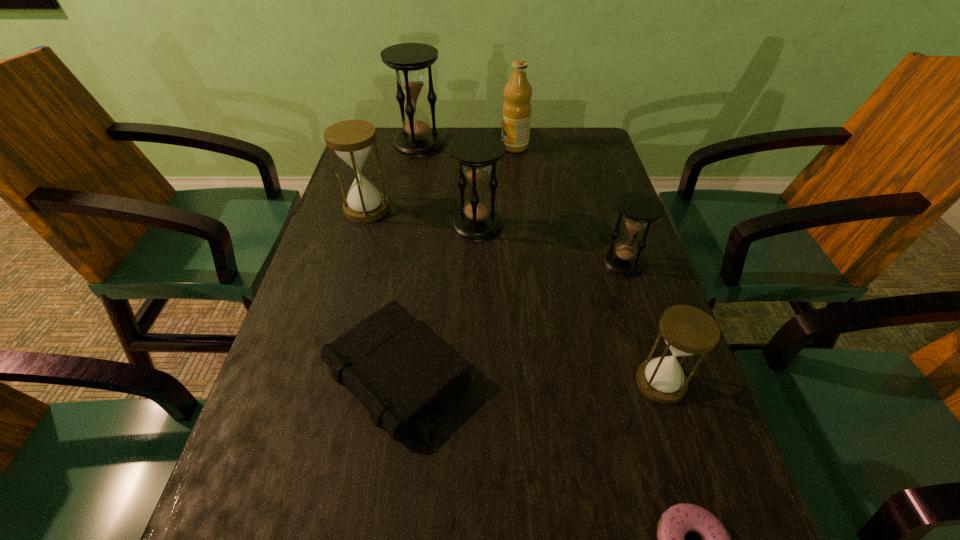
At what (x,y) coordinates should I click in order to perform the action: click on unoccupied area between the fourth nearest object and the nearest hourglass. Please return your answer as a coordinate pair (x, y). Looking at the image, I should click on (641, 322).

Locate an element on the screen. The height and width of the screenshot is (540, 960). unoccupied area between the smaller white hourglass and the third hourglass from left to right is located at coordinates (569, 303).

Locate an element on the screen. This screenshot has height=540, width=960. blank region between the fifth farthest object and the Bible is located at coordinates (510, 318).

The image size is (960, 540). What are the coordinates of `free space between the nearer white hourglass and the olive oil` in the screenshot? It's located at (588, 264).

Locate an element on the screen. free point between the smallest black hourglass and the fourth object from right to left is located at coordinates tap(568, 205).

Image resolution: width=960 pixels, height=540 pixels. In order to click on free space between the Bible and the nearest hourglass in this screenshot , I will do `click(529, 377)`.

Identify the location of free spot between the left white hourglass and the olive oil. (441, 178).

Identify which object is the third nearest to the shortest object. Please provide its 2D coordinates. Your answer should be formatted as a tuple, i.e. [(x, y)], where the tuple contains the x and y coordinates of a point satisfying the conditions above.

[(639, 209)]

Locate which object is the fifth closest to the left white hourglass. Please provide its 2D coordinates. Your answer should be formatted as a tuple, i.e. [(x, y)], where the tuple contains the x and y coordinates of a point satisfying the conditions above.

[(639, 209)]

You are a GUI agent. You are given a task and a screenshot of the screen. Output one action in this format:
    pyautogui.click(x=<x>, y=<y>)
    Task: Click on the hourglass that can be found as the third closest to the leftmost black hourglass
    This screenshot has height=540, width=960.
    Given the screenshot: What is the action you would take?
    point(639,209)